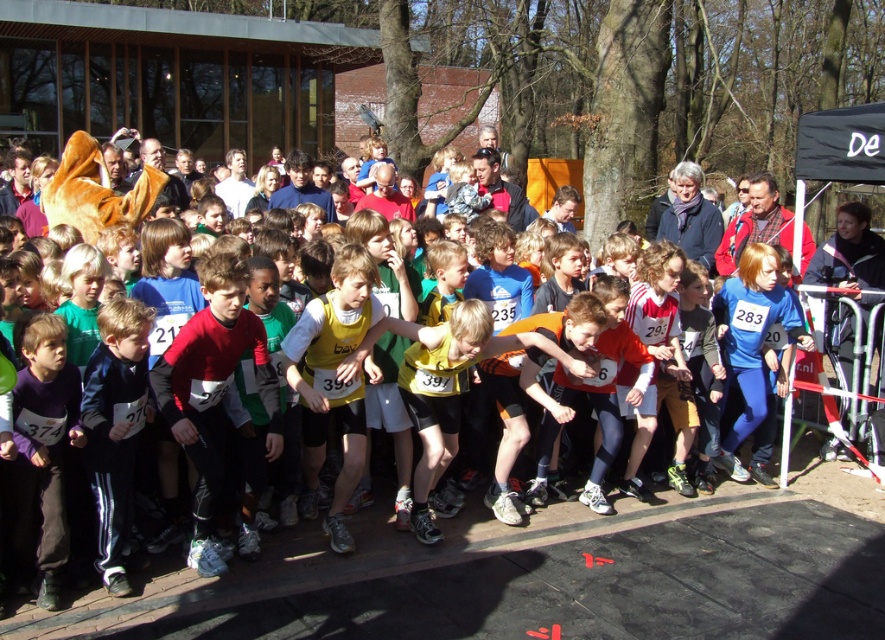
You are a photographer positioned at the starting line of the children running event. You need to take a photo of both the yellow fabric shirt at center and the dark blue tracksuit at center. Which one should you focus on first to ensure both are in clear focus?

You should focus on the yellow fabric shirt at center first because it is closer to you than the dark blue tracksuit at center, so adjusting focus from near to far will help both be in clear focus.

You are a photographer positioned at the starting line of the children running event. You need to capture a clear photo of both the yellow fabric shirt at center and the dark blue tracksuit at center. Which clothing item will appear bigger in your photo?

The yellow fabric shirt at center will appear bigger in the photo because it is larger in size than the dark blue tracksuit at center.

You are a photographer at the children running event. You need to capture a photo of both the purple matte shirt at center and dark blue tracksuit at center. Which one of them is smaller in size so you can adjust your camera focus accordingly?

The purple matte shirt at center is smaller than the dark blue tracksuit at center, so you should focus on the purple matte shirt at center first as it is smaller.